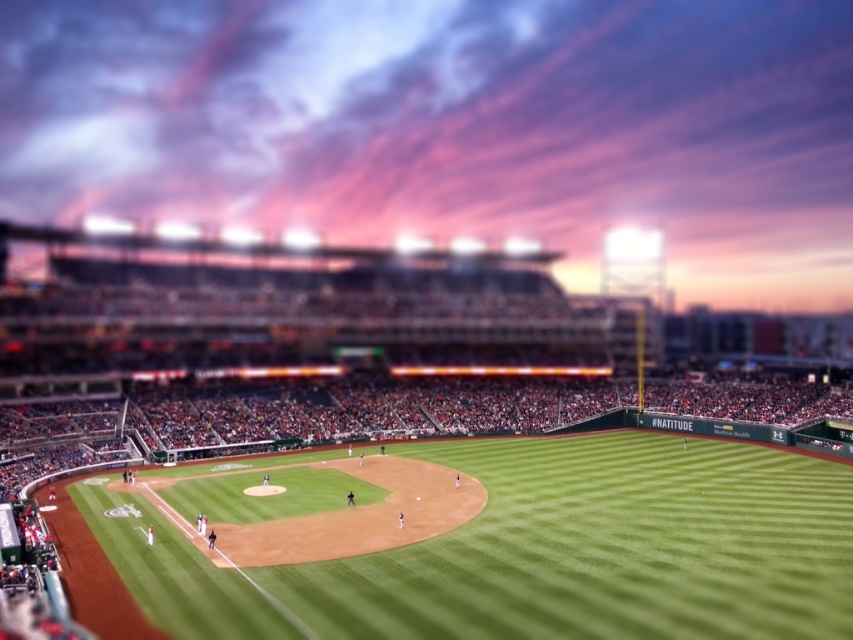
Which of these two, green grass baseball stadium at center or green grass field at center, stands taller?

Standing taller between the two is green grass baseball stadium at center.

Does green grass baseball stadium at center appear on the left side of green grass field at center?

Indeed, green grass baseball stadium at center is positioned on the left side of green grass field at center.

This screenshot has height=640, width=853. Describe the element at coordinates (485, 545) in the screenshot. I see `green grass baseball stadium at center` at that location.

Identify the location of green grass baseball stadium at center. (485, 545).